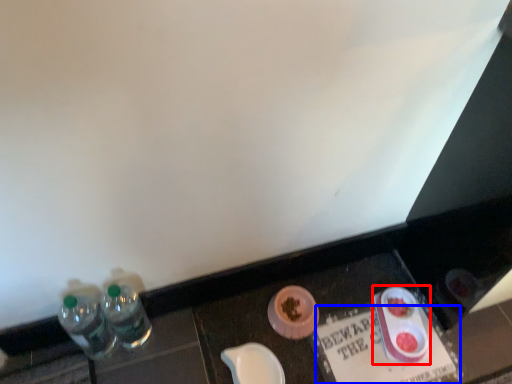
Question: Which of the following is the closest to the observer, tableware (highlighted by a red box) or writing (highlighted by a blue box)?

Choices:
 (A) tableware
 (B) writing

Answer: (B)